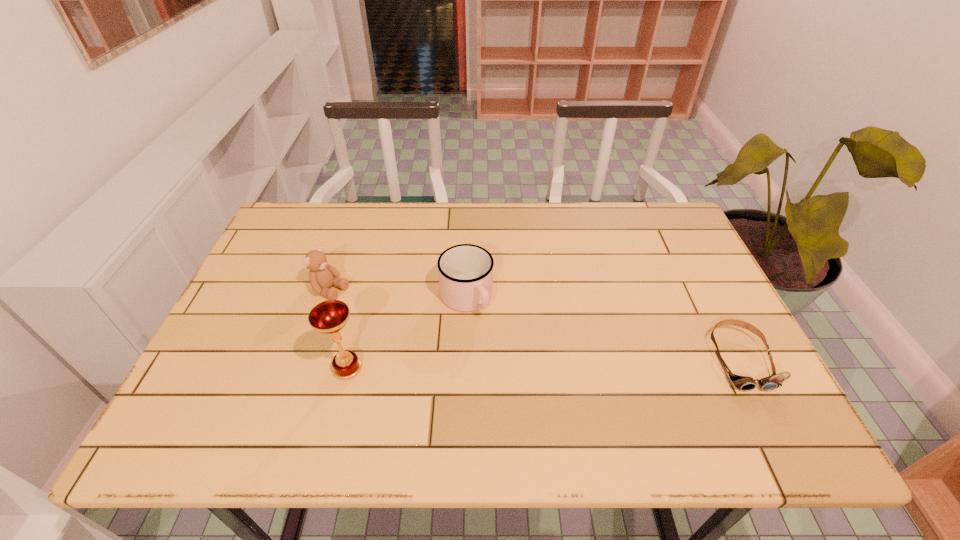
Where is `vacant space on the desktop that is between the second object from left to right and the rightmost object and is positioned on the front-facing side of the leftmost object`? Image resolution: width=960 pixels, height=540 pixels. vacant space on the desktop that is between the second object from left to right and the rightmost object and is positioned on the front-facing side of the leftmost object is located at coordinates (487, 365).

At what (x,y) coordinates should I click in order to perform the action: click on vacant space on the desktop that is between the tallest object and the rightmost object and is positioned on the side of the mug with the handle. Please return your answer as a coordinate pair (x, y). Looking at the image, I should click on (509, 364).